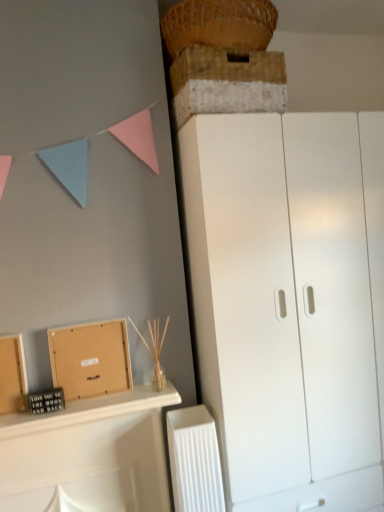
Question: Considering the relative positions of white plastic radiator at lower center and woven straw basket at upper center in the image provided, is white plastic radiator at lower center in front of woven straw basket at upper center?

Choices:
 (A) no
 (B) yes

Answer: (A)

Question: From a real-world perspective, does white plastic radiator at lower center stand above woven straw basket at upper center?

Choices:
 (A) no
 (B) yes

Answer: (A)

Question: Is white plastic radiator at lower center not near woven straw basket at upper center?

Choices:
 (A) yes
 (B) no

Answer: (A)

Question: Is white plastic radiator at lower center bigger than woven straw basket at upper center?

Choices:
 (A) no
 (B) yes

Answer: (A)

Question: Can you confirm if white plastic radiator at lower center is positioned to the right of woven straw basket at upper center?

Choices:
 (A) no
 (B) yes

Answer: (A)

Question: Can you confirm if white plastic radiator at lower center is thinner than woven straw basket at upper center?

Choices:
 (A) no
 (B) yes

Answer: (B)

Question: Considering the relative sizes of white matte cupboard at right and brown cardboard box at lower left in the image provided, is white matte cupboard at right bigger than brown cardboard box at lower left?

Choices:
 (A) no
 (B) yes

Answer: (B)

Question: Could brown cardboard box at lower left be considered to be inside white matte cupboard at right?

Choices:
 (A) yes
 (B) no

Answer: (B)

Question: From the image's perspective, would you say white matte cupboard at right is shown under brown cardboard box at lower left?

Choices:
 (A) no
 (B) yes

Answer: (B)

Question: Is white matte cupboard at right thinner than brown cardboard box at lower left?

Choices:
 (A) yes
 (B) no

Answer: (B)

Question: Does white matte cupboard at right have a smaller size compared to brown cardboard box at lower left?

Choices:
 (A) yes
 (B) no

Answer: (B)

Question: From a real-world perspective, is white matte cupboard at right below brown cardboard box at lower left?

Choices:
 (A) yes
 (B) no

Answer: (A)

Question: Is brown cardboard box at lower left a part of rustic wooden crate at upper center?

Choices:
 (A) yes
 (B) no

Answer: (B)